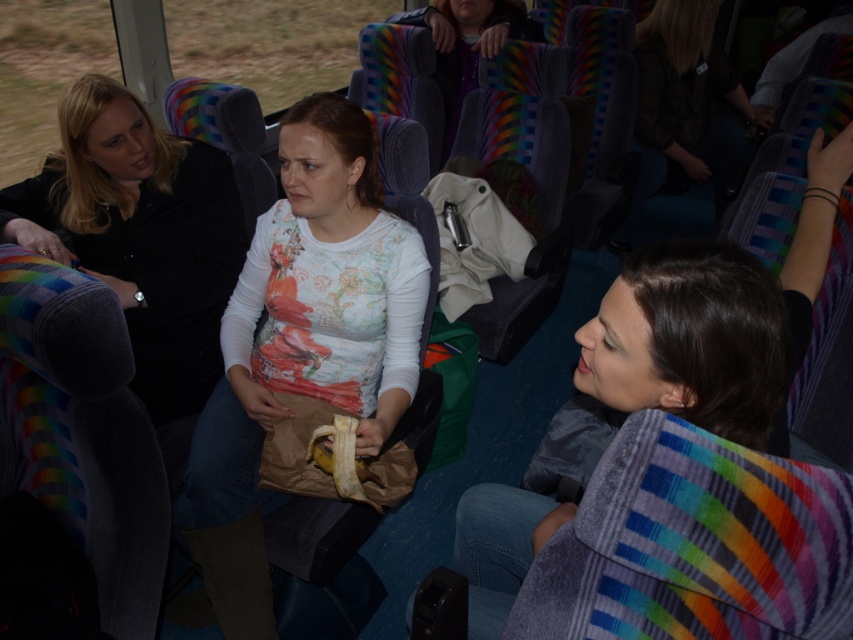
What are the coordinates of `floral printed shirt at center` in the screenshot? It's located at (303, 340).

Is floral printed shirt at center smaller than matte gray jacket at center?

No.

Locate an element on the screen. floral printed shirt at center is located at coordinates (303, 340).